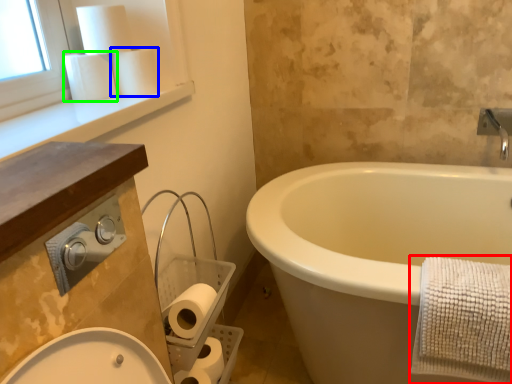
Question: Estimate the real-world distances between objects in this image. Which object is closer to bath towel (highlighted by a red box), toilet paper (highlighted by a blue box) or toilet paper (highlighted by a green box)?

Choices:
 (A) toilet paper
 (B) toilet paper

Answer: (A)